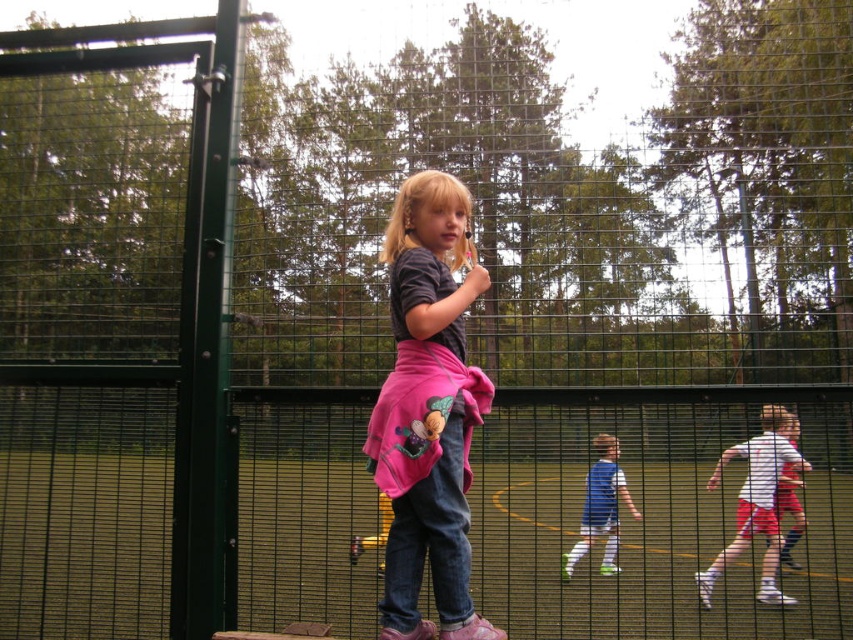
You are a photographer trying to capture a clear shot of the pink fabric skirt at center and the white matte shirt at center. Since you want both to be visible, which one should you focus on first to ensure it doesn

The pink fabric skirt at center is much taller than the white matte shirt at center, so you should focus on the pink fabric skirt at center first to ensure it is fully visible in the frame.

Based on the photo, you are a photographer trying to capture the white matte shirt at center and the blue jersey at center in the same frame. Which one should you focus on first to ensure both are in the frame?

The white matte shirt at center is located above the blue jersey at center, so you should focus on the blue jersey at center first to ensure both are in the frame.